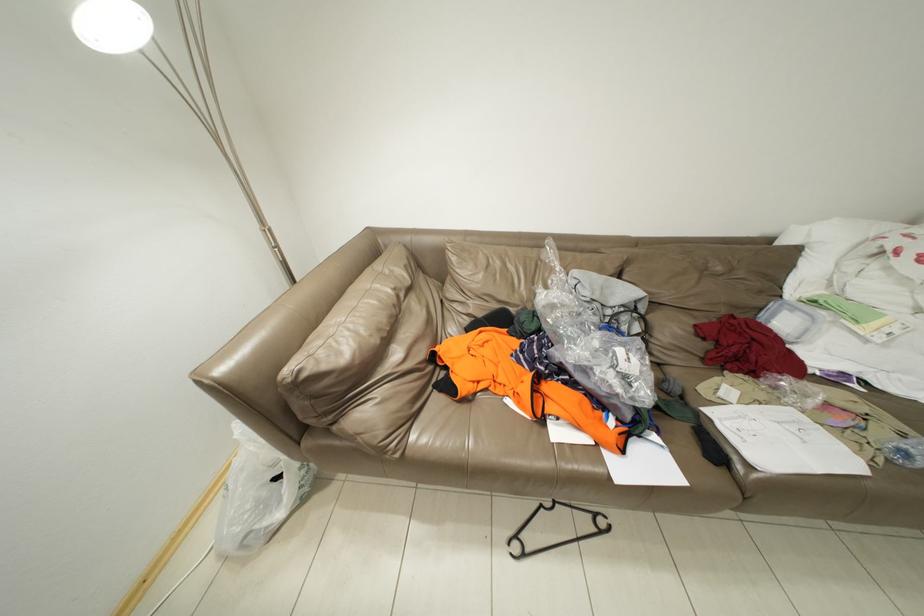
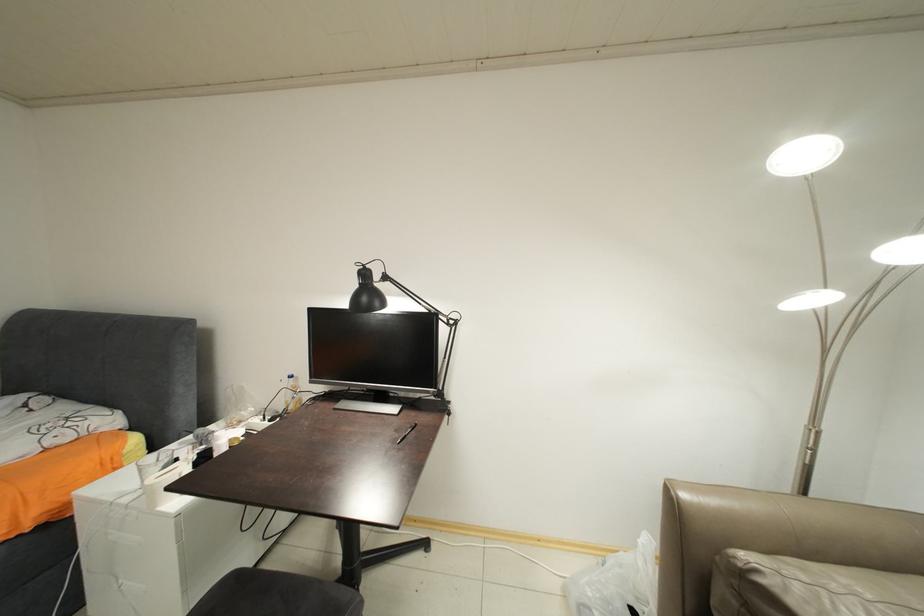
Question: The camera is either moving clockwise (left) or counter-clockwise (right) around the object. The first image is from the beginning of the video and the second image is from the end. Is the camera moving left or right when shooting the video?

Choices:
 (A) Left
 (B) Right

Answer: (B)